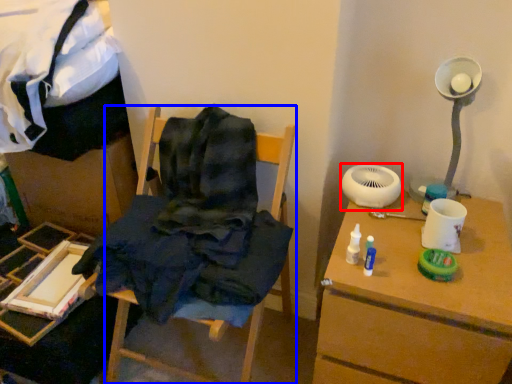
Question: Which point is further to the camera, mechanical fan (highlighted by a red box) or furniture (highlighted by a blue box)?

Choices:
 (A) mechanical fan
 (B) furniture

Answer: (A)